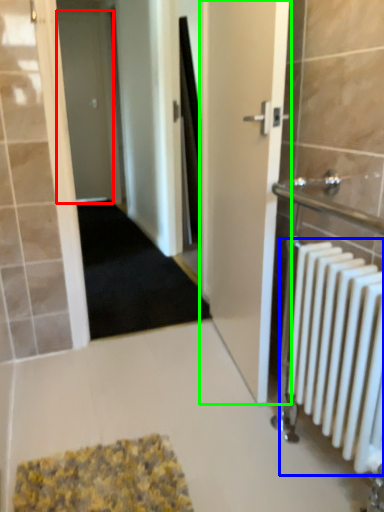
Question: Which object is positioned closest to door (highlighted by a red box)? Select from radiator (highlighted by a blue box) and door (highlighted by a green box).

Choices:
 (A) radiator
 (B) door

Answer: (B)